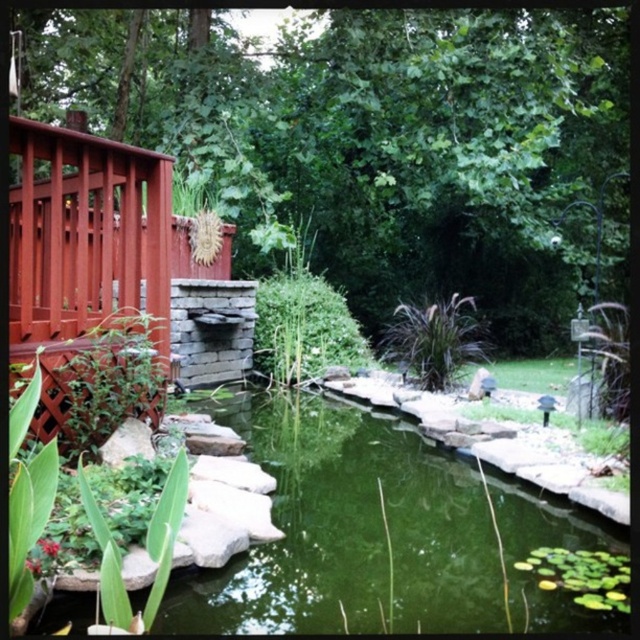
What is the 2D coordinate of the dark green grass at center?

The dark green grass at center is located at the 2D coordinate point of (433, 339).

You are standing on the wooden deck and looking towards the pond. You see a green leafy plant at center and dark green grass at center. Which one is located to the right side?

The dark green grass at center is located to the right side of the green leafy plant at center.